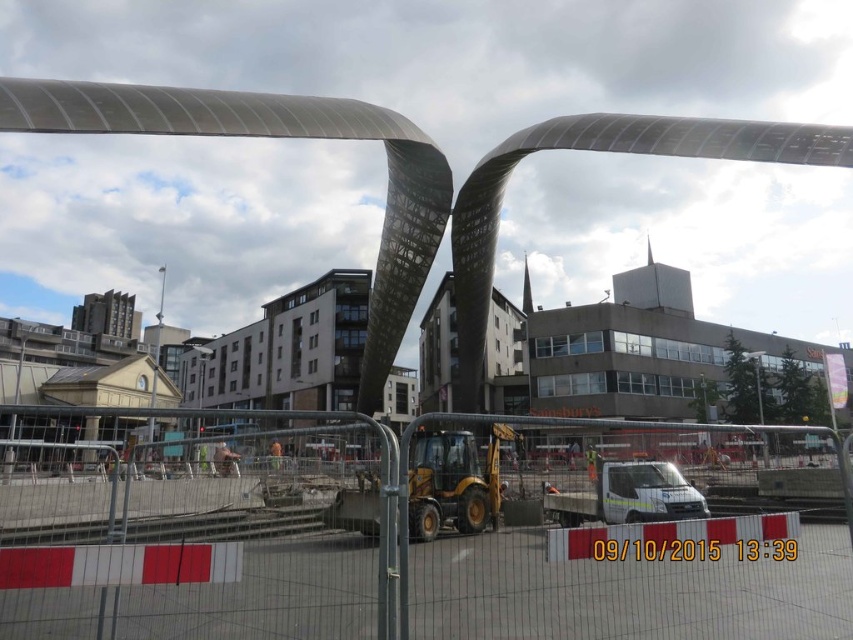
You are a construction worker who needs to set up a camera to monitor the construction site. The camera has a range of 10 feet. You want to place it near the white plastic fencing at lower center. Will the camera be able to monitor the entire area within its range?

The camera and white plastic fencing at lower center are 10.33 feet apart. Since the camera has a range of 10 feet, it cannot monitor the entire area because the distance exceeds its range by 0.33 feet.

You are a construction worker who needs to cross the white plastic fencing at lower center to reach the yellow rubber excavator at center. Is the fencing in your way?

The white plastic fencing at lower center is located below the yellow rubber excavator at center, so it is not blocking your path to the excavator.

You are a delivery driver approaching the construction site and need to navigate around the white plastic fencing at lower center. Based on its position, can you estimate whether it is placed closer to the foreground structure or the background buildings?

The white plastic fencing at lower center is located at point (421, 531), which places it closer to the foreground structure than the background buildings.